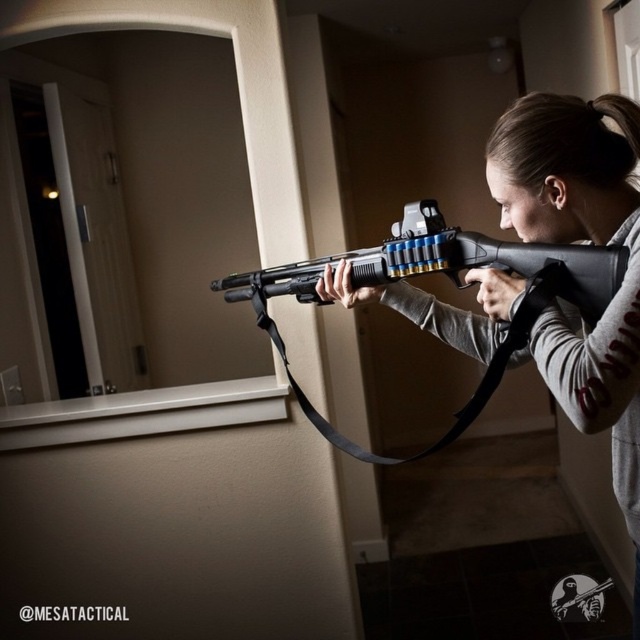
Can you confirm if matte black shotgun at center is positioned below black matte shotgun at center?

Indeed, matte black shotgun at center is positioned under black matte shotgun at center.

Is the position of matte black shotgun at center more distant than that of black matte shotgun at center?

No, matte black shotgun at center is in front of black matte shotgun at center.

Which is behind, point (618, 360) or point (401, 276)?

Point (401, 276)

Locate an element on the screen. This screenshot has width=640, height=640. matte black shotgun at center is located at coordinates (580, 240).